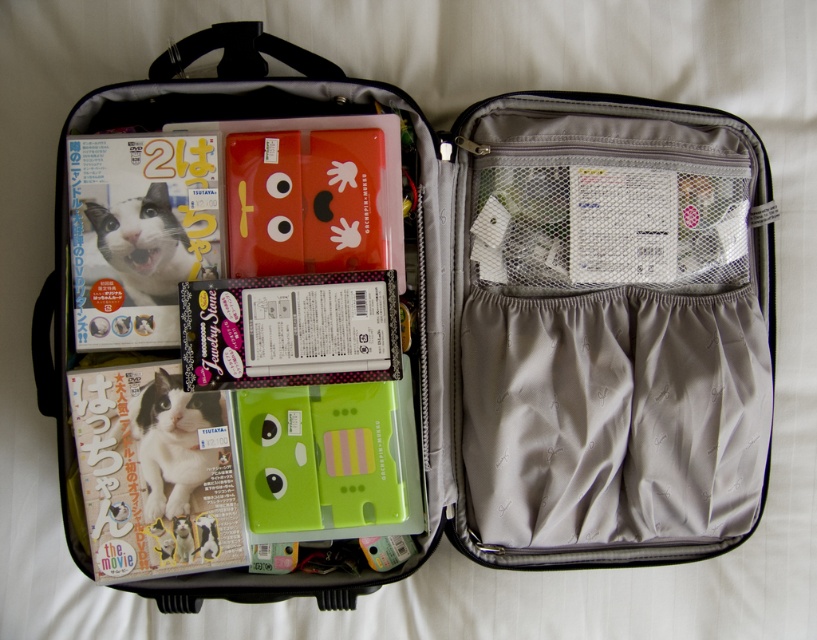
You are packing a suitcase and need to place a new item between the matte paper magazine at lower left and the matte paper magazine at left. Can you fit it if the item is 12 centimeters wide?

The distance between the matte paper magazine at lower left and the matte paper magazine at left is 12.73 centimeters. Since the new item is 12 centimeters wide, it can fit in the space between them.

You are packing a suitcase and need to know which magazine is taller to decide stacking order. Which is taller between the matte paper magazine at lower left and the matte paper magazine at left?

The matte paper magazine at lower left is taller than the matte paper magazine at left, so it should be placed at the bottom for stability.

You are packing for a trip and see the matte paper magazine at lower left and the matte paper magazine at left in your suitcase. Which magazine is closer to the bottom of the suitcase?

The matte paper magazine at lower left is positioned under the matte paper magazine at left, so it is closer to the bottom of the suitcase.